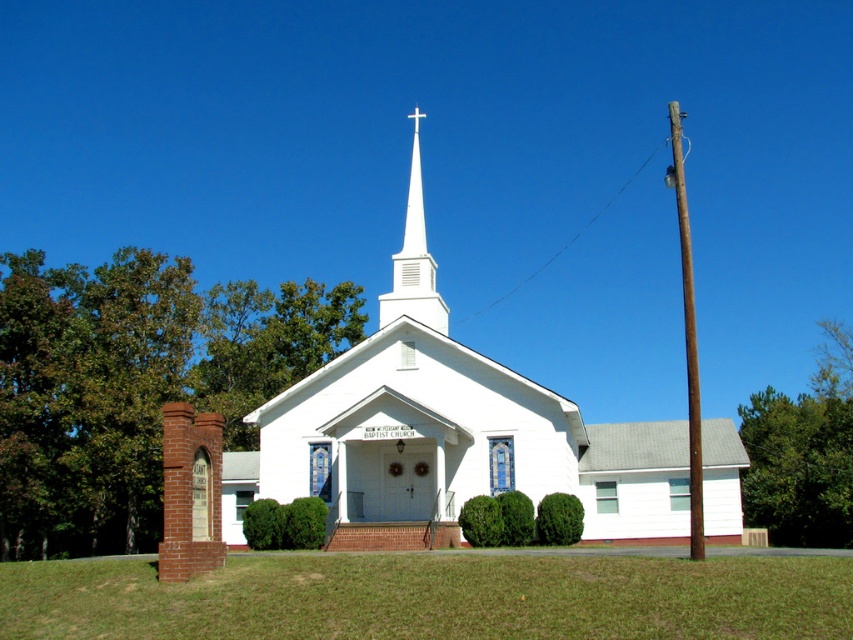
Question: Can you confirm if white matte church at center is wider than brown wooden pole at right?

Choices:
 (A) yes
 (B) no

Answer: (B)

Question: Among these points, which one is nearest to the camera?

Choices:
 (A) (x=410, y=205)
 (B) (x=705, y=461)

Answer: (B)

Question: Is white smooth steeple at center closer to the viewer compared to brown wooden pole at right?

Choices:
 (A) no
 (B) yes

Answer: (A)

Question: Is the position of white smooth steeple at center more distant than that of brown wooden pole at right?

Choices:
 (A) no
 (B) yes

Answer: (B)

Question: Which object is the closest to the white matte church at center?

Choices:
 (A) white smooth steeple at center
 (B) brown wooden pole at right

Answer: (A)

Question: Estimate the real-world distances between objects in this image. Which object is closer to the white matte church at center?

Choices:
 (A) white smooth steeple at center
 (B) brown wooden pole at right

Answer: (A)